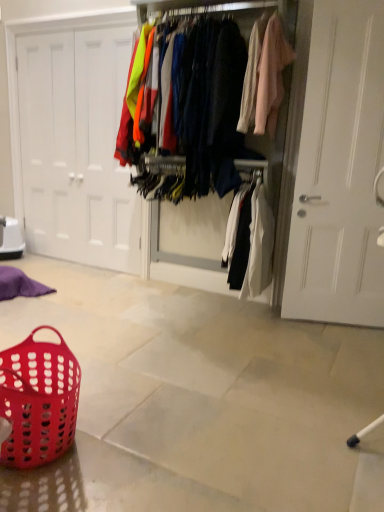
Describe the element at coordinates (272, 149) in the screenshot. The height and width of the screenshot is (512, 384). I see `matte fabric clothes at center` at that location.

Where is `matte plastic basket at lower left`? matte plastic basket at lower left is located at coordinates (200, 401).

You are a GUI agent. You are given a task and a screenshot of the screen. Output one action in this format:
    pyautogui.click(x=<x>, y=<y>)
    Task: Click on the matte fabric clothes at center
    This screenshot has width=384, height=512.
    Given the screenshot: What is the action you would take?
    pyautogui.click(x=272, y=149)

Is white matte door at left located outside translucent red plastic basket at lower left?

Yes, white matte door at left is outside of translucent red plastic basket at lower left.

From a real-world perspective, does white matte door at left sit lower than translucent red plastic basket at lower left?

No, from a real-world perspective, white matte door at left is not beneath translucent red plastic basket at lower left.

Does white matte door at left come behind translucent red plastic basket at lower left?

Yes, white matte door at left is further from the viewer.

Find the location of a particular element. The width and height of the screenshot is (384, 512). door behind the translucent red plastic basket at lower left is located at coordinates (77, 147).

From the image's perspective, which is above, white matte door at left or matte fabric clothes at center?

white matte door at left is shown above in the image.

Considering the sizes of objects white matte door at left and matte fabric clothes at center in the image provided, who is taller, white matte door at left or matte fabric clothes at center?

white matte door at left.

Which of these two, matte plastic basket at lower left or white matte door at left, stands shorter?

Standing shorter between the two is matte plastic basket at lower left.

Is matte plastic basket at lower left to the right of white matte door at left from the viewer's perspective?

Yes.

In the scene shown: Measure the distance from matte plastic basket at lower left to white matte door at left.

The distance of matte plastic basket at lower left from white matte door at left is 1.65 meters.

Which of these two, matte plastic basket at lower left or white matte door at left, is bigger?

Bigger between the two is matte plastic basket at lower left.

Does matte plastic basket at lower left have a lesser height compared to translucent red plastic basket at lower left?

Yes.

Can you tell me how much matte plastic basket at lower left and translucent red plastic basket at lower left differ in facing direction?

matte plastic basket at lower left and translucent red plastic basket at lower left are facing 66.4 degrees away from each other.

Is matte plastic basket at lower left inside or outside of translucent red plastic basket at lower left?

The correct answer is: outside.

Between matte plastic basket at lower left and translucent red plastic basket at lower left, which one appears on the left side from the viewer's perspective?

matte plastic basket at lower left is more to the left.

Considering the relative positions of white matte door at left and matte plastic basket at lower left in the image provided, is white matte door at left to the left or to the right of matte plastic basket at lower left?

white matte door at left is positioned on matte plastic basket at lower left's left side.

From a real-world perspective, is white matte door at left positioned above or below matte plastic basket at lower left?

white matte door at left is situated higher than matte plastic basket at lower left in the real world.

Considering the sizes of objects matte fabric clothes at center and white matte door at left in the image provided, who is smaller, matte fabric clothes at center or white matte door at left?

white matte door at left.

Which point is more forward, (255, 137) or (37, 37)?

The point (255, 137) is closer to the camera.

Is matte fabric clothes at center in contact with white matte door at left?

No, matte fabric clothes at center is not in contact with white matte door at left.

From the image's perspective, is matte fabric clothes at center located beneath white matte door at left?

Yes, from the image's perspective, matte fabric clothes at center is below white matte door at left.

Looking at this image, considering the positions of objects translucent red plastic basket at lower left and matte fabric clothes at center in the image provided, who is more to the right, translucent red plastic basket at lower left or matte fabric clothes at center?

From the viewer's perspective, matte fabric clothes at center appears more on the right side.

From their relative heights in the image, would you say translucent red plastic basket at lower left is taller or shorter than matte fabric clothes at center?

In the image, translucent red plastic basket at lower left appears to be shorter than matte fabric clothes at center.

Where is `closet located above the translucent red plastic basket at lower left (from a real-world perspective)`? The image size is (384, 512). closet located above the translucent red plastic basket at lower left (from a real-world perspective) is located at coordinates (272, 149).

Identify the location of door lying above the translucent red plastic basket at lower left (from the image's perspective). The height and width of the screenshot is (512, 384). (77, 147).

Identify the location of closet below the white matte door at left (from the image's perspective). click(272, 149).

Which object lies further to the anchor point matte fabric clothes at center, matte plastic basket at lower left or translucent red plastic basket at lower left?

translucent red plastic basket at lower left lies further to matte fabric clothes at center than the other object.

Consider the image. Looking at the image, which one is located further to translucent red plastic basket at lower left, matte plastic basket at lower left or matte fabric clothes at center?

Among the two, matte fabric clothes at center is located further to translucent red plastic basket at lower left.

Which object lies further to the anchor point white matte door at left, matte plastic basket at lower left or matte fabric clothes at center?

matte fabric clothes at center lies further to white matte door at left than the other object.

Based on their spatial positions, is matte plastic basket at lower left or white matte door at left further from translucent red plastic basket at lower left?

Based on the image, white matte door at left appears to be further to translucent red plastic basket at lower left.

Looking at the image, which one is located further to matte fabric clothes at center, matte plastic basket at lower left or white matte door at left?

Based on the image, white matte door at left appears to be further to matte fabric clothes at center.

Looking at the image, which one is located closer to translucent red plastic basket at lower left, matte fabric clothes at center or matte plastic basket at lower left?

matte plastic basket at lower left is closer to translucent red plastic basket at lower left.

When comparing their distances from matte fabric clothes at center, does white matte door at left or translucent red plastic basket at lower left seem further?

translucent red plastic basket at lower left.

Based on their spatial positions, is translucent red plastic basket at lower left or white matte door at left closer to matte plastic basket at lower left?

translucent red plastic basket at lower left lies closer to matte plastic basket at lower left than the other object.

Find the location of a particular element. basket located between matte plastic basket at lower left and white matte door at left in the depth direction is located at coordinates (38, 400).

Identify the location of closet between matte plastic basket at lower left and white matte door at left along the z-axis. Image resolution: width=384 pixels, height=512 pixels. (272, 149).

The width and height of the screenshot is (384, 512). I want to click on closet located between translucent red plastic basket at lower left and white matte door at left in the depth direction, so click(272, 149).

You are a GUI agent. You are given a task and a screenshot of the screen. Output one action in this format:
    pyautogui.click(x=<x>, y=<y>)
    Task: Click on the basket located between matte plastic basket at lower left and matte fabric clothes at center in the depth direction
    
    Given the screenshot: What is the action you would take?
    pos(38,400)